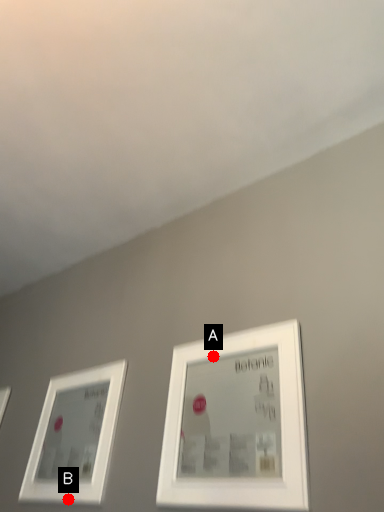
Question: Two points are circled on the image, labeled by A and B beside each circle. Which point is closer to the camera?

Choices:
 (A) A is closer
 (B) B is closer

Answer: (A)